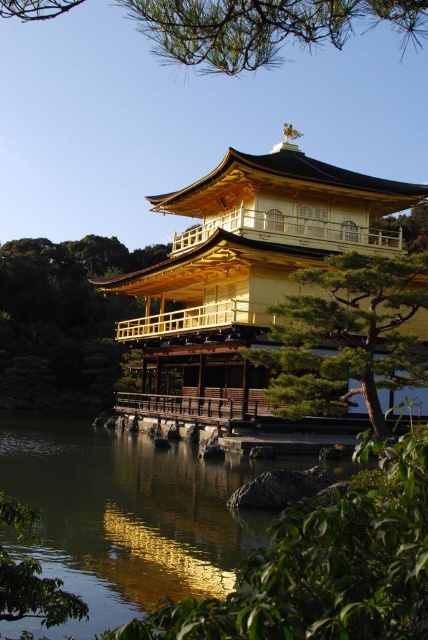
You are visiting Kinkakuji and want to take a photo of both the green textured pine tree at center and the green leafy tree at center. Which tree should you stand closer to in order to capture both in the frame?

You should stand closer to the green textured pine tree at center because it is shorter than the green leafy tree at center, allowing both to fit within the camera frame.

You are a photographer planning to take a photo of the Golden Pavilion. You want to include both the green pine branches at upper center and the green leafy tree at lower left in your shot. Which of these two objects will appear bigger in the photo?

The green pine branches at upper center will appear bigger in the photo because they have a larger size compared to the green leafy tree at lower left.

You are standing at the wooden walkway leading to Kinkakuji and want to take a photo of both the green leafy tree at center and the green leafy tree at lower left. Which tree should you move closer to in order to include both in your frame?

You should move closer to the green leafy tree at lower left because the green leafy tree at center is closer to you, so adjusting your position towards the farther tree will help balance their sizes in the photo.